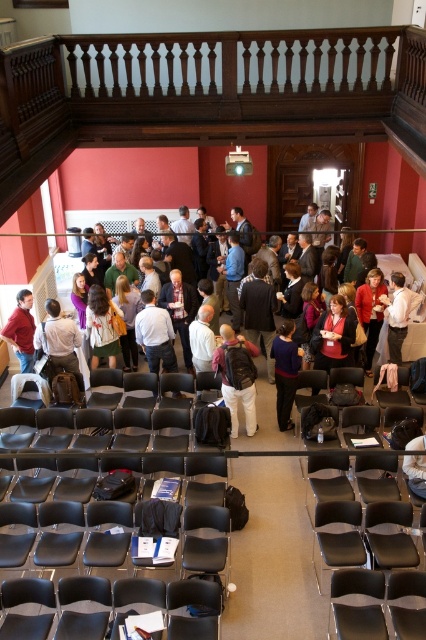
Question: Which of the following is the closest to the observer?

Choices:
 (A) (31, 296)
 (B) (333, 294)

Answer: (A)

Question: Estimate the real-world distances between objects in this image. Which object is closer to the black leather chair at lower right?

Choices:
 (A) light brown leather jacket at center
 (B) matte red shirt at center
 (C) matte black chair at lower right
 (D) matte white shirt at center

Answer: (C)

Question: Based on their relative distances, which object is farther from the light brown leather jacket at center?

Choices:
 (A) matte red shirt at center
 (B) matte white shirt at center
 (C) matte black jacket at center
 (D) black leather chair at lower center

Answer: (A)

Question: Can you confirm if black leather chair at lower center is positioned to the left of dark gray backpack at center?

Choices:
 (A) yes
 (B) no

Answer: (A)

Question: Does matte black chair at lower right appear on the right side of matte white shirt at center?

Choices:
 (A) yes
 (B) no

Answer: (A)

Question: Does matte black chair at lower right appear over matte blue sweater at center?

Choices:
 (A) yes
 (B) no

Answer: (B)